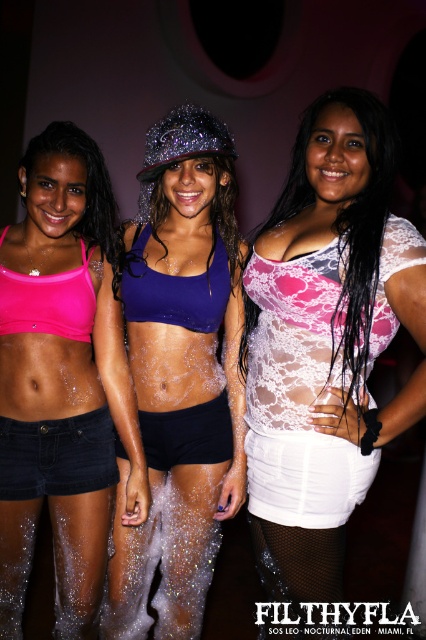
You are a photographer at the nightclub trying to capture the perfect shot. You need to focus on the lace fabric top at center. Based on its position, where should you aim your camera?

The lace fabric top at center is located at point (328, 324), so you should aim your camera at those coordinates to focus on it.

You are a photographer trying to capture a closeup of both the purple shiny sports bra at center and the pink matte sports bra at center. Given that your camera lens has a maximum focus range of 7 inches, will you be able to focus on both subjects simultaneously?

The purple shiny sports bra at center and pink matte sports bra at center are 7.29 inches apart, which exceeds the camera lens maximum focus range of 7 inches. Therefore, you cannot focus on both subjects simultaneously.

You are a photographer trying to capture a closeup of the person on the left. You have to decide whether to focus on point (x=83, y=476) or point (x=160, y=436). Which point should you choose?

Point (x=83, y=476) is closer to the camera than point (x=160, y=436), so you should focus on point (x=83, y=476) to capture a closeup of the person on the left.